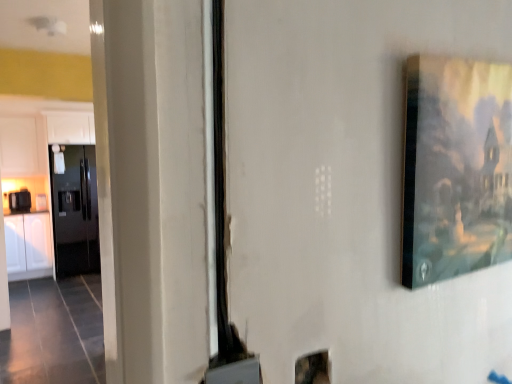
Question: Does glossy black refrigerator at left have a smaller size compared to black glossy toaster at left?

Choices:
 (A) yes
 (B) no

Answer: (B)

Question: From a real-world perspective, is glossy black refrigerator at left beneath black glossy toaster at left?

Choices:
 (A) yes
 (B) no

Answer: (A)

Question: Is black glossy toaster at left surrounded by glossy black refrigerator at left?

Choices:
 (A) no
 (B) yes

Answer: (A)

Question: Can you confirm if glossy black refrigerator at left is bigger than black glossy toaster at left?

Choices:
 (A) yes
 (B) no

Answer: (A)

Question: Is glossy black refrigerator at left looking in the opposite direction of black glossy toaster at left?

Choices:
 (A) yes
 (B) no

Answer: (B)

Question: Looking at the image, does matte wooden picture frame at upper right seem bigger or smaller compared to glossy black refrigerator at left?

Choices:
 (A) small
 (B) big

Answer: (A)

Question: From the image's perspective, is matte wooden picture frame at upper right positioned above or below glossy black refrigerator at left?

Choices:
 (A) below
 (B) above

Answer: (B)

Question: Is matte wooden picture frame at upper right in front of or behind glossy black refrigerator at left in the image?

Choices:
 (A) behind
 (B) front

Answer: (B)

Question: Would you say matte wooden picture frame at upper right is inside or outside glossy black refrigerator at left?

Choices:
 (A) outside
 (B) inside

Answer: (A)

Question: Is glossy black refrigerator at left in front of or behind matte wooden picture frame at upper right in the image?

Choices:
 (A) front
 (B) behind

Answer: (B)

Question: In the image, is glossy black refrigerator at left on the left side or the right side of matte wooden picture frame at upper right?

Choices:
 (A) right
 (B) left

Answer: (B)

Question: From the image's perspective, is glossy black refrigerator at left positioned above or below matte wooden picture frame at upper right?

Choices:
 (A) above
 (B) below

Answer: (B)

Question: Is glossy black refrigerator at left spatially inside matte wooden picture frame at upper right, or outside of it?

Choices:
 (A) outside
 (B) inside

Answer: (A)

Question: Is point (79, 233) closer or farther from the camera than point (17, 251)?

Choices:
 (A) farther
 (B) closer

Answer: (B)

Question: In terms of height, does glossy black refrigerator at left look taller or shorter compared to white glossy cabinet at left, the 2th cabinetry from the top?

Choices:
 (A) tall
 (B) short

Answer: (A)